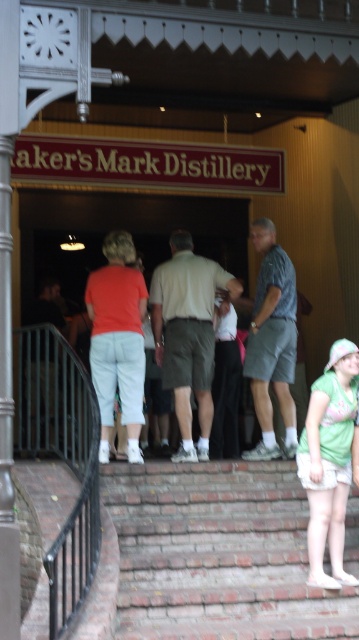
Question: Which of the following is the farthest from the observer?

Choices:
 (A) brick stairs at center
 (B) white cotton shirt at center
 (C) green fabric shorts at lower right
 (D) light brown fabric shirt at center

Answer: (B)

Question: Which of the following is the farthest from the observer?

Choices:
 (A) (123, 310)
 (B) (48, 333)
 (C) (216, 392)
 (D) (341, 460)

Answer: (C)

Question: Can you confirm if green fabric shorts at lower right is positioned to the left of matte coral blouse at center?

Choices:
 (A) no
 (B) yes

Answer: (A)

Question: Estimate the real-world distances between objects in this image. Which object is farther from the gray fabric shorts at center?

Choices:
 (A) green fabric shorts at lower right
 (B) brick stairs at center
 (C) white cotton shirt at center

Answer: (B)

Question: Is black metal railing at lower left behind white cotton shirt at center?

Choices:
 (A) no
 (B) yes

Answer: (A)

Question: Can you confirm if light brown fabric shirt at center is positioned to the right of matte coral blouse at center?

Choices:
 (A) yes
 (B) no

Answer: (A)